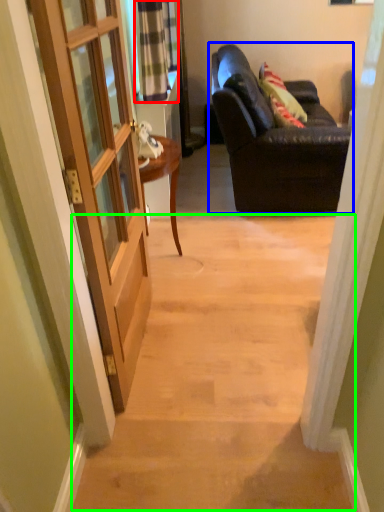
Question: Based on their relative distances, which object is farther from curtain (highlighted by a red box)? Choose from studio couch (highlighted by a blue box) and stairwell (highlighted by a green box).

Choices:
 (A) studio couch
 (B) stairwell

Answer: (B)